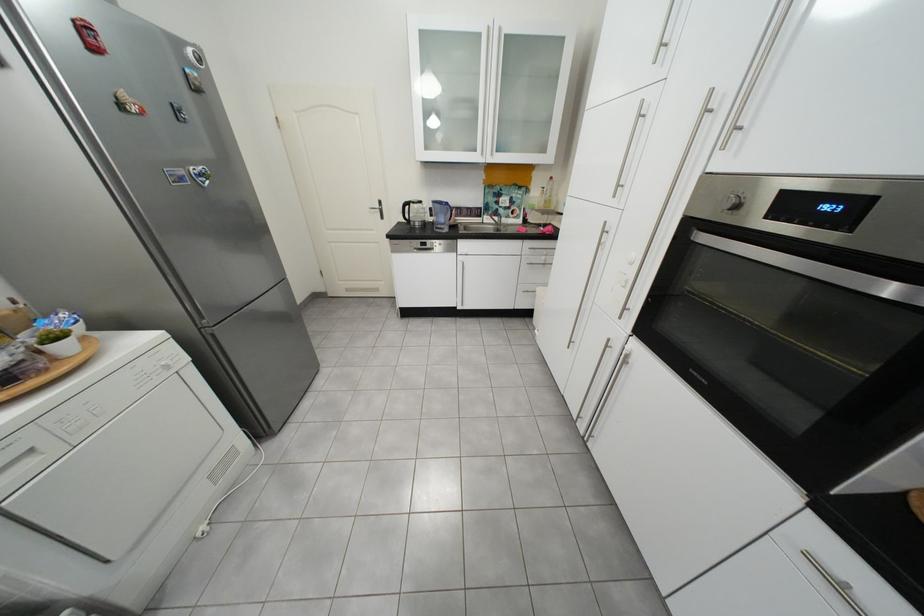
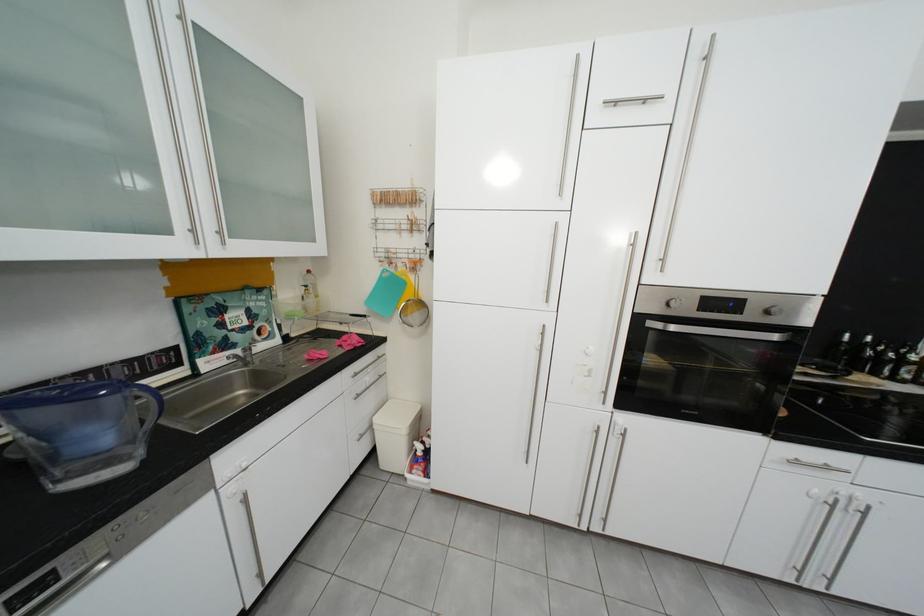
The point at (448, 230) is marked in the first image. Where is the corresponding point in the second image?

(70, 483)